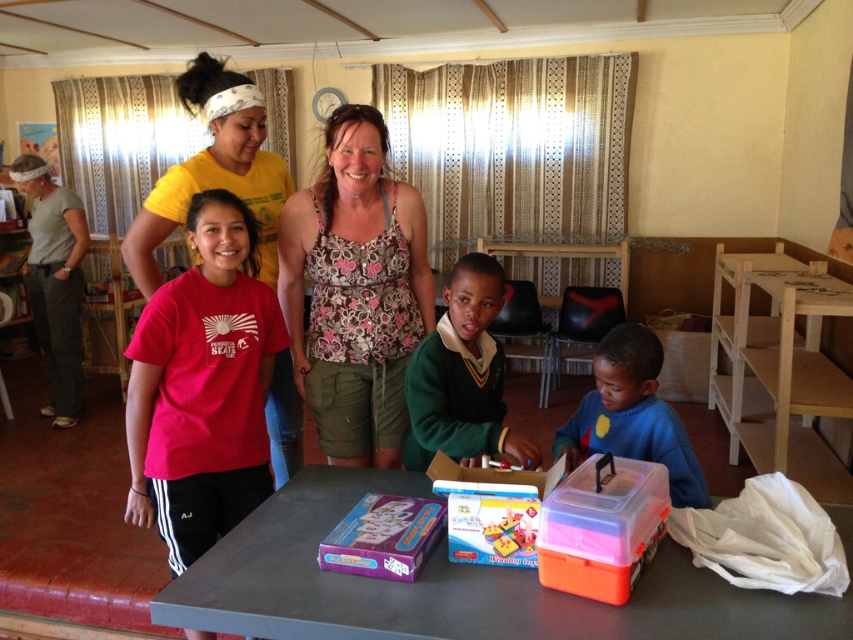
Question: Which point is farther from the camera taking this photo?

Choices:
 (A) (523, 509)
 (B) (74, 225)

Answer: (B)

Question: Which point is farther from the camera taking this photo?

Choices:
 (A) (537, 616)
 (B) (677, 445)
 (C) (51, 241)
 (D) (743, 317)

Answer: (C)

Question: Is matte yellow t-shirt at center positioned before green wool sweater at center?

Choices:
 (A) no
 (B) yes

Answer: (A)

Question: Does light brown wooden table at right appear on the left side of blue matte plastic container at lower right?

Choices:
 (A) no
 (B) yes

Answer: (A)

Question: Is light brown wooden table at right bigger than translucent plastic toy at center?

Choices:
 (A) yes
 (B) no

Answer: (A)

Question: Which object is positioned closest to the green wool sweater at center?

Choices:
 (A) matte yellow t-shirt at center
 (B) light brown wooden table at right

Answer: (A)